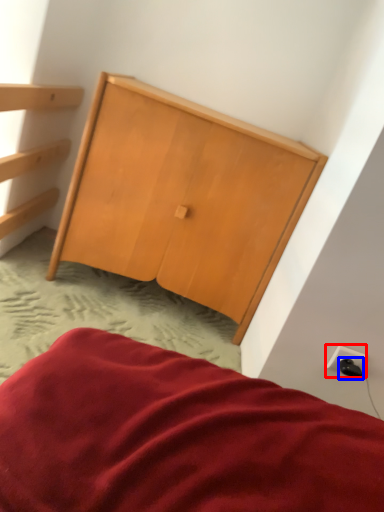
Question: Which point is further to the camera, electric outlet (highlighted by a red box) or plug (highlighted by a blue box)?

Choices:
 (A) electric outlet
 (B) plug

Answer: (A)